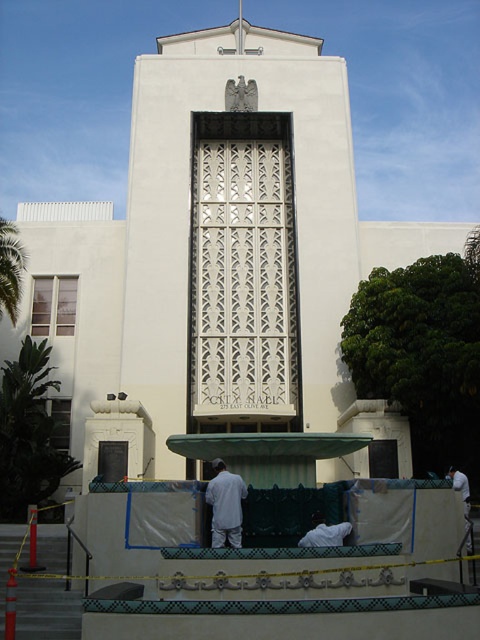
Which is in front, point (214, 538) or point (459, 484)?

Point (214, 538) is in front.

Is white cotton shirt at center taller than white fabric at lower right?

Incorrect, white cotton shirt at center's height is not larger of white fabric at lower right's.

The image size is (480, 640). What do you see at coordinates (226, 506) in the screenshot? I see `white cotton shirt at center` at bounding box center [226, 506].

Where is `white cotton shirt at center`? This screenshot has height=640, width=480. white cotton shirt at center is located at coordinates (226, 506).